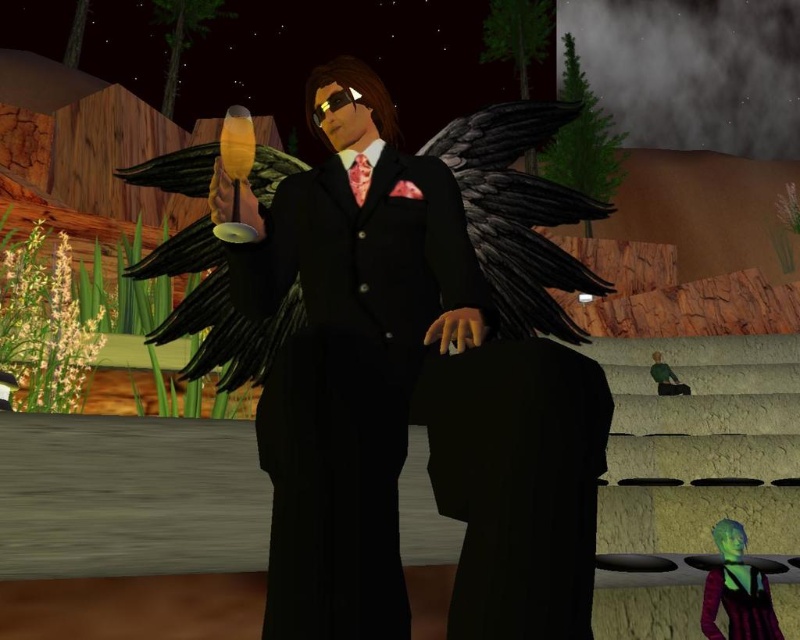
Question: Estimate the real-world distances between objects in this image. Which object is farther from the black matte wings at center?

Choices:
 (A) purple striped dress at lower right
 (B) black satin suit at center

Answer: (A)

Question: Does black satin suit at center have a greater width compared to purple striped dress at lower right?

Choices:
 (A) yes
 (B) no

Answer: (A)

Question: Estimate the real-world distances between objects in this image. Which object is closer to the black matte wings at center?

Choices:
 (A) black satin suit at center
 (B) purple striped dress at lower right

Answer: (A)

Question: Is black matte wings at center below purple striped dress at lower right?

Choices:
 (A) no
 (B) yes

Answer: (A)

Question: Can you confirm if black matte wings at center is positioned to the right of purple striped dress at lower right?

Choices:
 (A) yes
 (B) no

Answer: (B)

Question: Which object is the closest to the black satin suit at center?

Choices:
 (A) black matte wings at center
 (B) purple striped dress at lower right

Answer: (A)